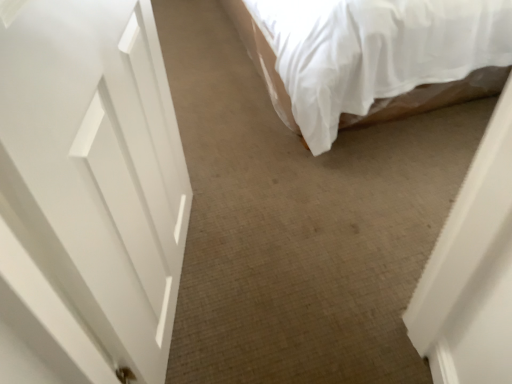
Find the location of a particular element. The width and height of the screenshot is (512, 384). vacant space underneath white glossy door at left (from a real-world perspective) is located at coordinates (187, 278).